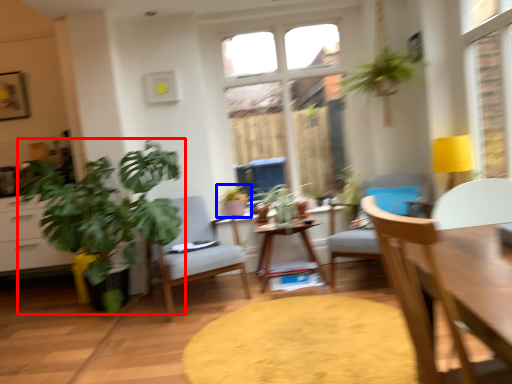
Question: Among these objects, which one is nearest to the camera, houseplant (highlighted by a red box) or houseplant (highlighted by a blue box)?

Choices:
 (A) houseplant
 (B) houseplant

Answer: (A)